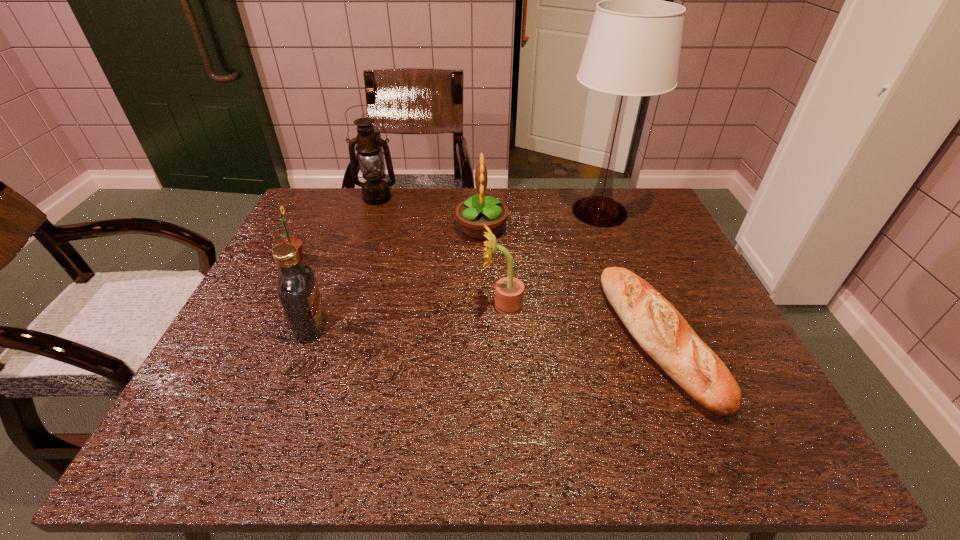
You are a GUI agent. You are given a task and a screenshot of the screen. Output one action in this format:
    pyautogui.click(x=<x>, y=<y>)
    Task: Click on the vacant space located 0.110m on the face of the farthest sunflower
    
    Given the screenshot: What is the action you would take?
    pyautogui.click(x=419, y=228)

I want to click on free location located on the face of the farthest sunflower, so click(436, 228).

Identify the location of free space located on the face of the farthest sunflower. (392, 228).

In order to click on vacant region located on the face of the nearest sunflower in this screenshot , I will do `click(432, 305)`.

Image resolution: width=960 pixels, height=540 pixels. Find the location of `vacant area situated on the face of the nearest sunflower`. vacant area situated on the face of the nearest sunflower is located at coordinates (372, 305).

Locate an element on the screen. This screenshot has width=960, height=540. vacant space located 0.310m on the face of the nearest sunflower is located at coordinates (351, 305).

Image resolution: width=960 pixels, height=540 pixels. I want to click on vacant region located on the front-facing side of the vodka, so click(378, 327).

Find the location of a particular element. The width and height of the screenshot is (960, 540). blank area located 0.210m on the face of the second nearest sunflower is located at coordinates (384, 258).

Where is `free space located on the back of the shortest object`? This screenshot has width=960, height=540. free space located on the back of the shortest object is located at coordinates (607, 208).

You are a GUI agent. You are given a task and a screenshot of the screen. Output one action in this format:
    pyautogui.click(x=<x>, y=<y>)
    Task: Click on the table lamp at the far edge
    
    Given the screenshot: What is the action you would take?
    pyautogui.click(x=633, y=49)